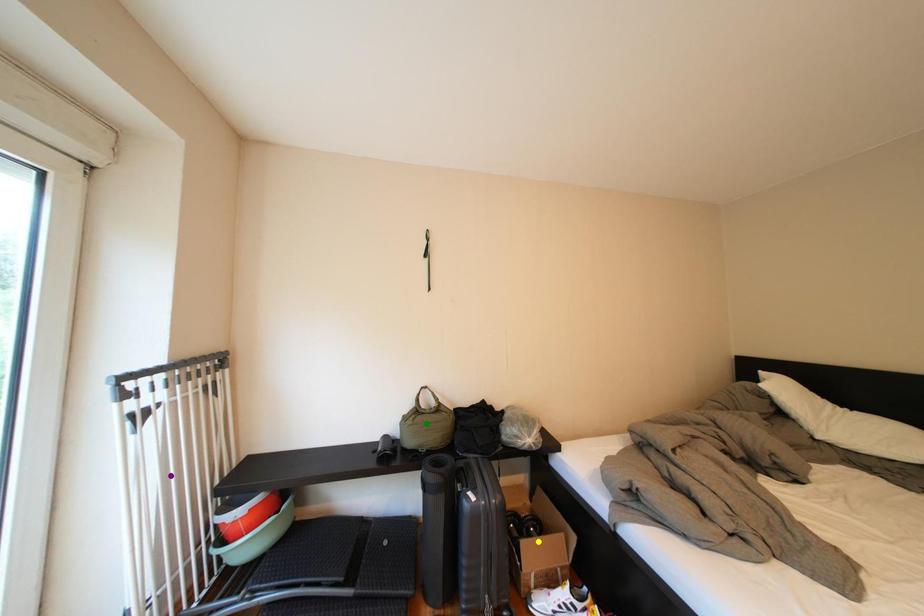
Order these from nearest to farthest:
- yellow point
- purple point
- green point

green point → yellow point → purple point